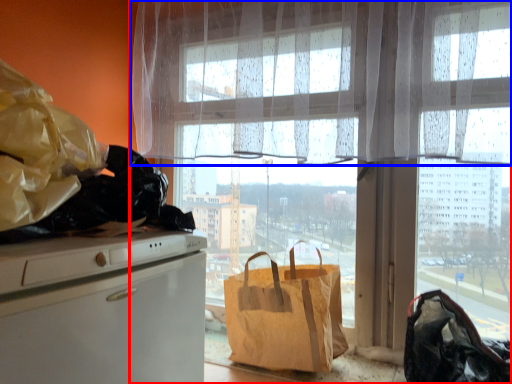
Question: Which point is closer to the camera, window (highlighted by a red box) or curtain (highlighted by a blue box)?

Choices:
 (A) window
 (B) curtain

Answer: (B)